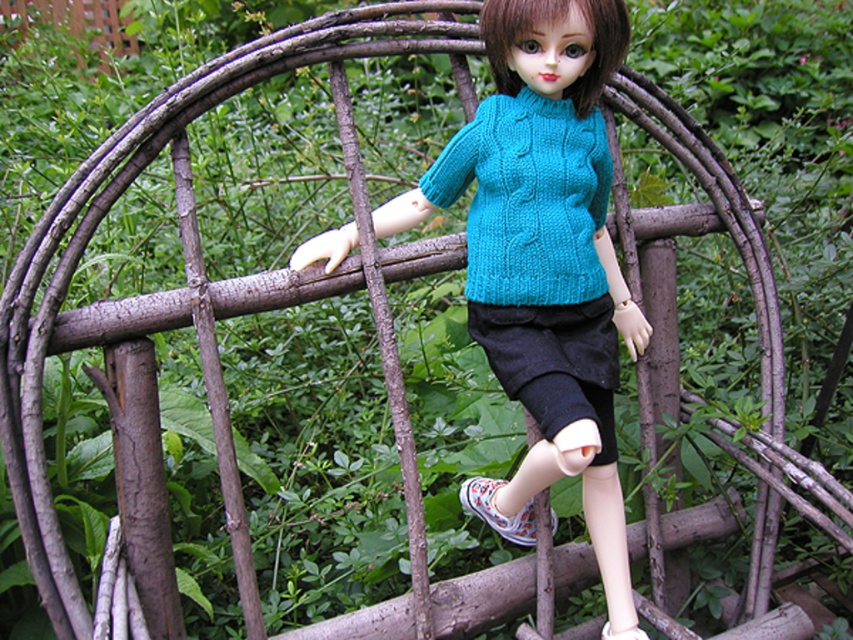
Question: Is cable-knit teal sweater at center bigger than white canvas shoe at lower center?

Choices:
 (A) yes
 (B) no

Answer: (A)

Question: Is turquoise knitted sweater at center below white canvas shoe at lower center?

Choices:
 (A) yes
 (B) no

Answer: (B)

Question: Which point is closer to the camera taking this photo?

Choices:
 (A) (495, 513)
 (B) (598, 420)
 (C) (643, 636)
 (D) (445, 182)

Answer: (B)

Question: Is turquoise knitted sweater at center below white canvas shoe at lower center?

Choices:
 (A) yes
 (B) no

Answer: (B)

Question: Which of the following is the closest to the observer?

Choices:
 (A) (x=468, y=138)
 (B) (x=525, y=508)

Answer: (A)

Question: Which point is closer to the camera taking this photo?

Choices:
 (A) (643, 632)
 (B) (521, 529)
 (C) (606, 45)
 (D) (506, 136)

Answer: (C)